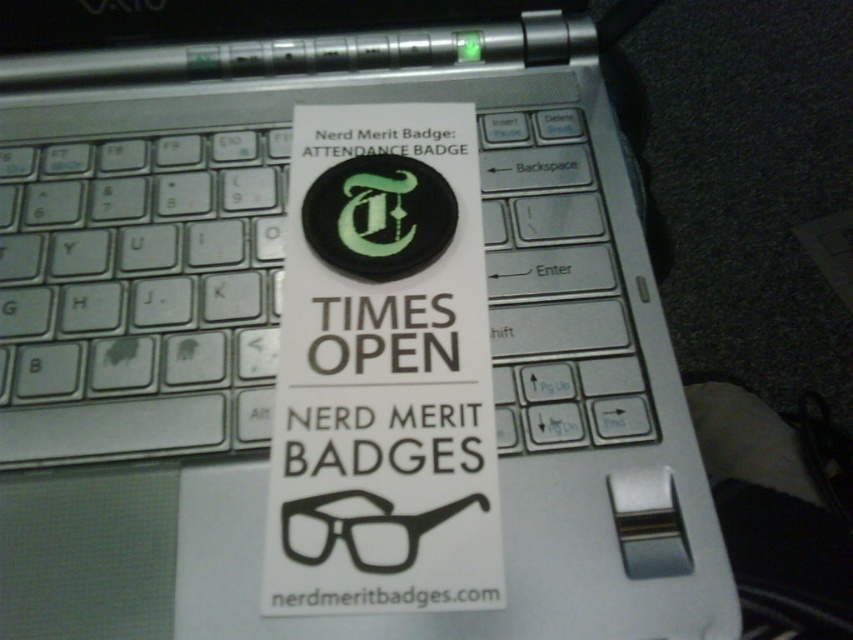
Between white paper sticker at center and black matte glasses at center, which one appears on the right side from the viewer's perspective?

From the viewer's perspective, black matte glasses at center appears more on the right side.

Is point (445, 509) positioned after point (395, 540)?

Yes, point (445, 509) is farther from viewer.

Where is `white paper sticker at center`? The height and width of the screenshot is (640, 853). white paper sticker at center is located at coordinates (383, 371).